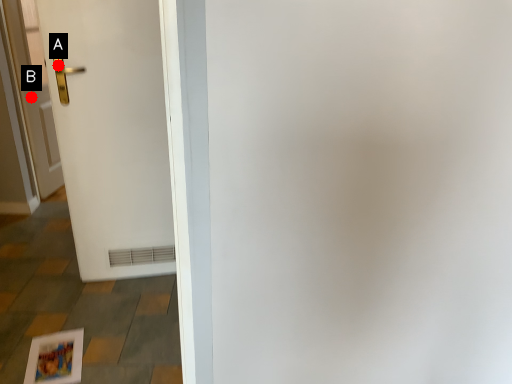
Question: Two points are circled on the image, labeled by A and B beside each circle. Which point is closer to the camera taking this photo?

Choices:
 (A) A is closer
 (B) B is closer

Answer: (A)